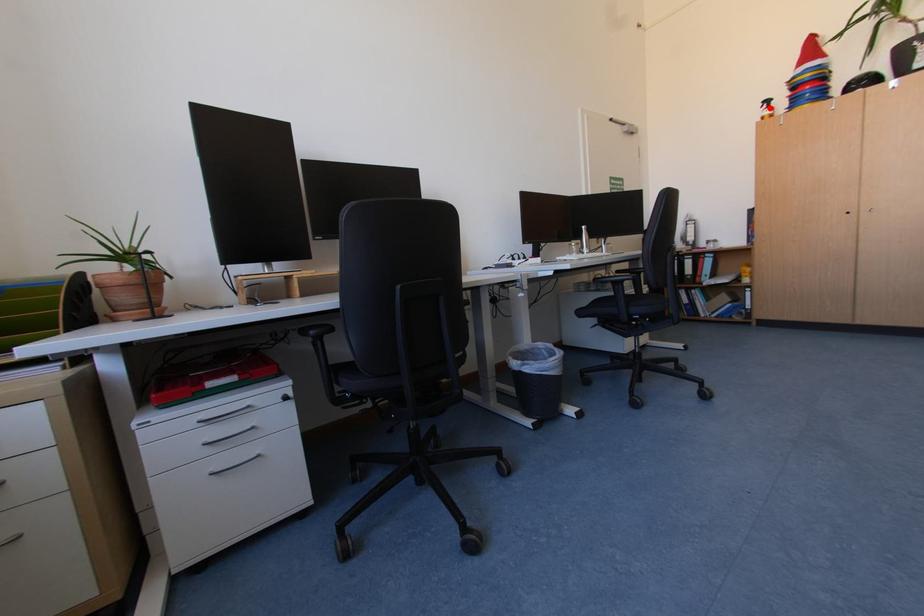
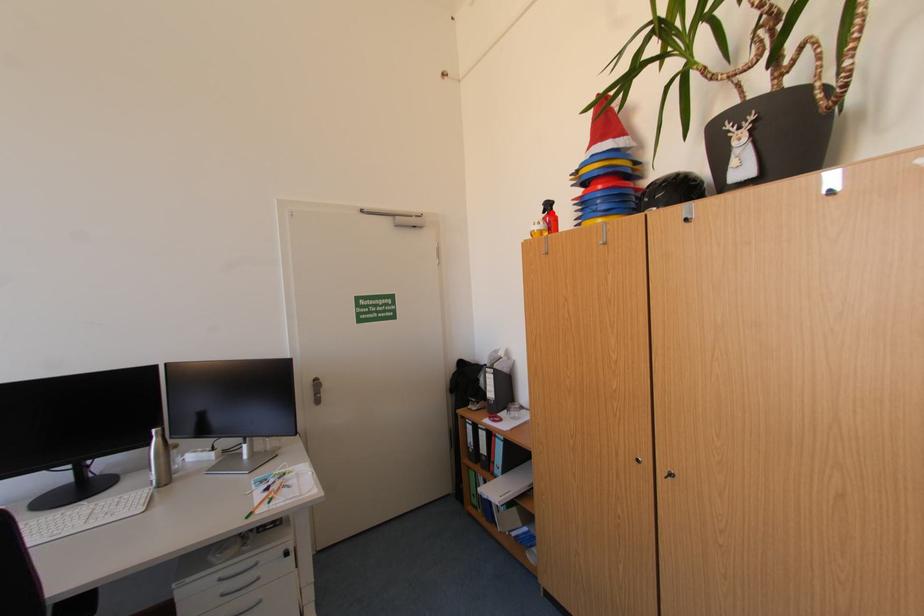
I am providing you with two images of the same scene from different viewpoints. A red point is marked on the first image and another point is marked on the second image. Is the marked point in image1 the same physical position as the marked point in image2?

Yes